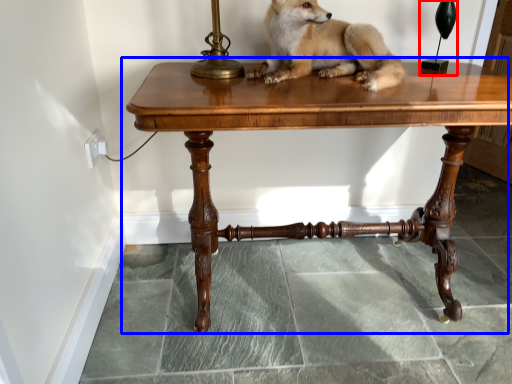
Question: Among these objects, which one is nearest to the camera, table lamp (highlighted by a red box) or table (highlighted by a blue box)?

Choices:
 (A) table lamp
 (B) table

Answer: (B)